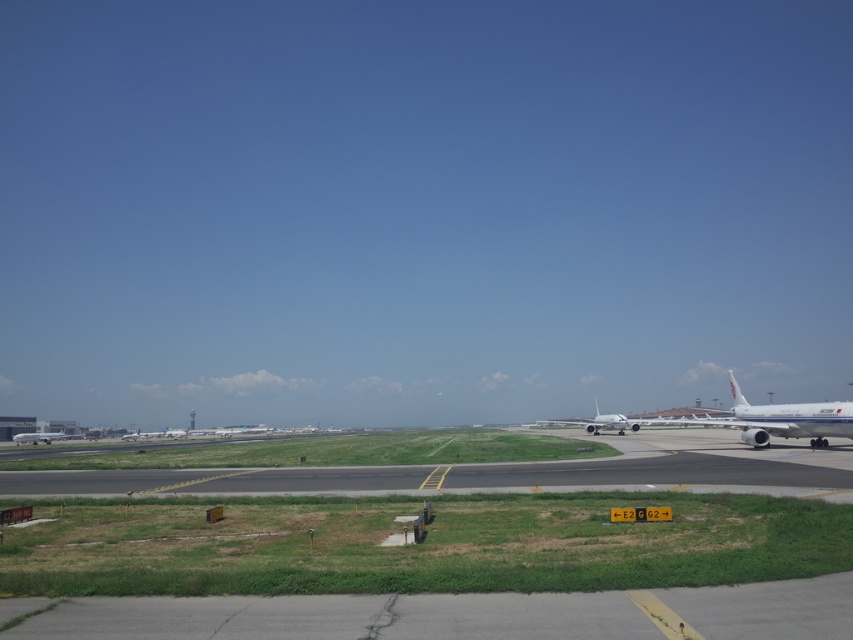
Question: Estimate the real-world distances between objects in this image. Which object is farther from the metallic silver airplane at lower left?

Choices:
 (A) black asphalt runway at center
 (B) white glossy airplane at right
 (C) metallic silver airplane at center

Answer: (A)

Question: Which of the following is the farthest from the observer?

Choices:
 (A) metallic silver airplane at lower left
 (B) white glossy airplane at right

Answer: (A)

Question: Is white glossy airplane at right below metallic silver airplane at center?

Choices:
 (A) yes
 (B) no

Answer: (B)

Question: Based on their relative distances, which object is nearer to the white glossy airplane at right?

Choices:
 (A) metallic silver airplane at center
 (B) metallic silver airplane at lower left
 (C) black asphalt runway at center

Answer: (C)

Question: Is black asphalt runway at center above metallic silver airplane at lower left?

Choices:
 (A) no
 (B) yes

Answer: (B)

Question: Is white glossy airplane at right positioned in front of metallic silver airplane at center?

Choices:
 (A) yes
 (B) no

Answer: (A)